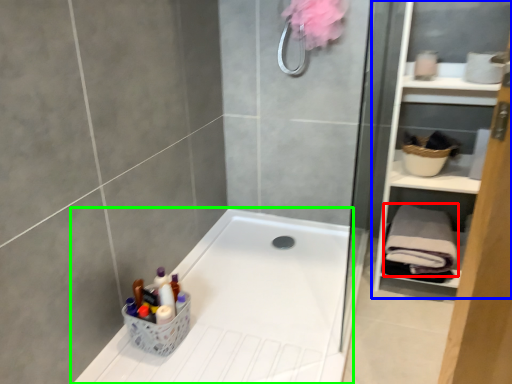
Question: Considering the real-world distances, which object is closest to bath towel (highlighted by a red box)? cabinet (highlighted by a blue box) or bathtub (highlighted by a green box).

Choices:
 (A) cabinet
 (B) bathtub

Answer: (A)